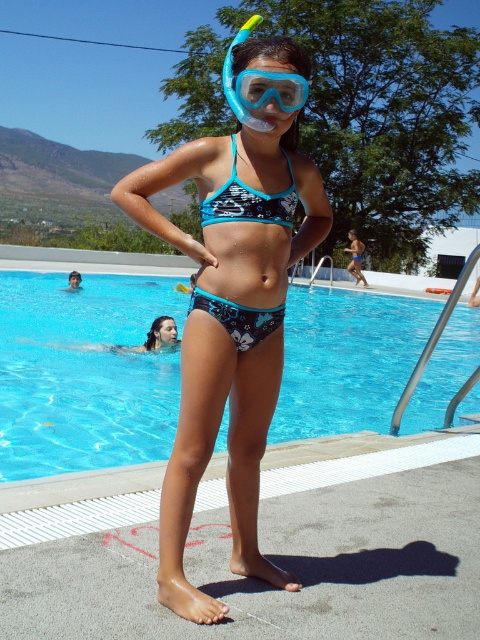
You are a photographer trying to capture a closeup shot of the swimmer. You have a camera with a lens that can focus on objects within a 10cm width. Given the matte blue bikini at center and transparent plastic goggles at center, which object can the camera focus on?

The transparent plastic goggles at center has a smaller width than the matte blue bikini at center, so the camera can focus on the transparent plastic goggles at center since its width is within the 10cm focus range.

Looking at this image, you are a photographer trying to capture the girl in the pool scene. You notice the blue printed bikini bottom at center and the transparent plastic goggles at center. Which of these two items is positioned lower on her body?

The blue printed bikini bottom at center is positioned lower on her body than the transparent plastic goggles at center.

You are a photographer trying to capture the reflection of the blue printed bikini bottom at center in the transparent blue water at center. Based on the scene description, can you confirm if the reflection is visible?

The transparent blue water at center is located below blue printed bikini bottom at center, so the reflection of the blue printed bikini bottom at center would be visible in the transparent blue water at center.